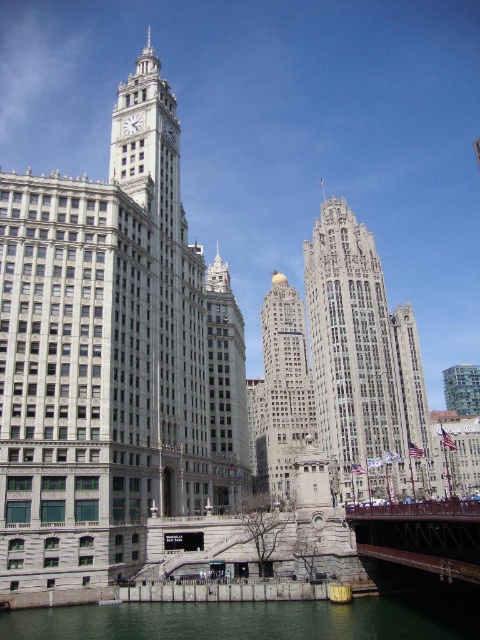
What are the coordinates of the gold polished stone tower at center?

The gold polished stone tower at center is located at coordinates point (282, 390).

You are standing at the observation deck of the Wrigley Building and want to take a photo of both point (287, 420) and point (224, 320) in the same frame. Which point will appear closer to the bottom edge of your camera viewfinder?

Point (224, 320) will appear closer to the bottom edge of the camera viewfinder because it is closer to the camera compared to point (287, 420), which is further away.

You are a city planner assessing the skyline for a new project. You need to determine which structure is taller between the gold polished stone tower at center and the metallic red bridge at lower right. Based on the scene provided, which one is taller?

The gold polished stone tower at center is taller than the metallic red bridge at lower right according to the description.